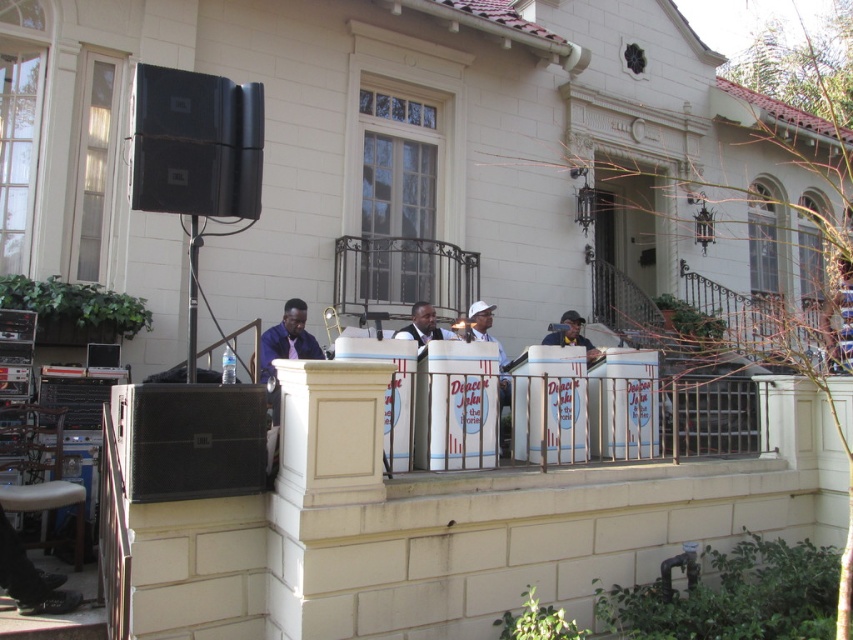
Question: Can you confirm if black matte speaker at upper left is positioned below metallic wrought iron balcony at center?

Choices:
 (A) no
 (B) yes

Answer: (A)

Question: Based on their relative distances, which object is farther from the white matte baseball cap at center?

Choices:
 (A) matte black speaker at center
 (B) metallic wrought iron balcony at center
 (C) black matte speaker at lower left

Answer: (C)

Question: Which of the following is the closest to the observer?

Choices:
 (A) (257, 176)
 (B) (16, 484)

Answer: (A)

Question: Which object is positioned closest to the white matte baseball cap at center?

Choices:
 (A) black matte speaker at upper left
 (B) dark blue suit at center

Answer: (B)

Question: In this image, where is black matte speaker at upper left located relative to metallic wrought iron balcony at center?

Choices:
 (A) above
 (B) below

Answer: (A)

Question: Does white leather stool at lower left have a greater width compared to blue fabric shirt at center?

Choices:
 (A) no
 (B) yes

Answer: (B)